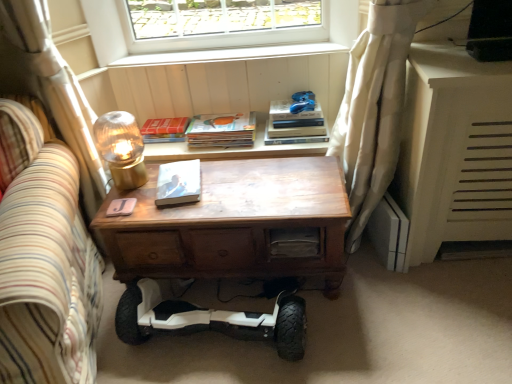
Where is `vacant area located to the right-hand side of white matte segway at lower center`? The width and height of the screenshot is (512, 384). vacant area located to the right-hand side of white matte segway at lower center is located at coordinates (356, 331).